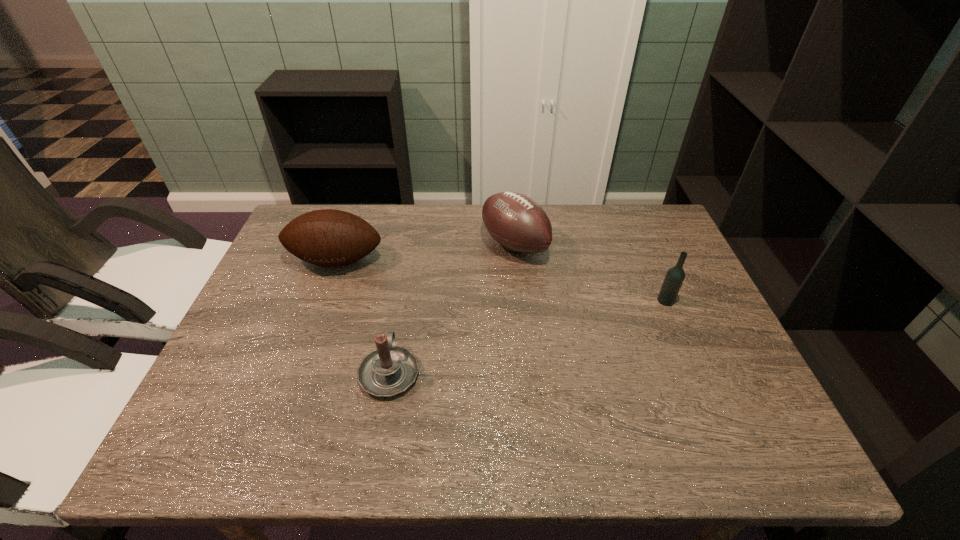
At what (x,y) coordinates should I click in order to perform the action: click on free space located on the side of the second object from left to right with the handle loop. Please return your answer as a coordinate pair (x, y). This screenshot has width=960, height=540. Looking at the image, I should click on (401, 305).

Where is `vacant space located 0.050m on the side of the second object from left to right with the handle loop`? The image size is (960, 540). vacant space located 0.050m on the side of the second object from left to right with the handle loop is located at coordinates [397, 329].

I want to click on object at the left edge, so click(327, 237).

The image size is (960, 540). I want to click on object that is at the right edge, so click(x=674, y=278).

Find the location of a particular element. Image resolution: width=960 pixels, height=540 pixels. object located in the far left corner section of the desktop is located at coordinates (327, 237).

In the image, there is a desktop. At what (x,y) coordinates should I click in order to perform the action: click on vacant space at the far edge. Please return your answer as a coordinate pair (x, y). The image size is (960, 540). Looking at the image, I should click on (394, 207).

In the image, there is a desktop. At what (x,y) coordinates should I click in order to perform the action: click on vacant space at the near edge. Please return your answer as a coordinate pair (x, y). Looking at the image, I should click on (288, 431).

Locate an element on the screen. The width and height of the screenshot is (960, 540). free space at the left edge of the desktop is located at coordinates (281, 346).

In the image, there is a desktop. At what (x,y) coordinates should I click in order to perform the action: click on vacant space at the right edge. Please return your answer as a coordinate pair (x, y). The width and height of the screenshot is (960, 540). Looking at the image, I should click on (697, 333).

Where is `free point at the far right corner`? free point at the far right corner is located at coordinates (632, 206).